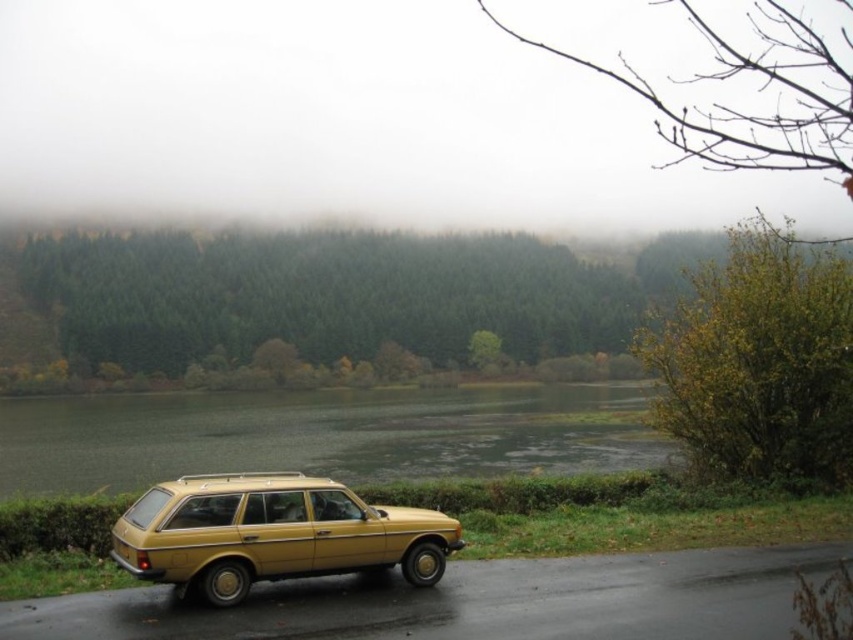
You are standing at the position of the vintage yellow station wagon parked on the wet dark road. Looking towards the lake, where would you see the green matte water at center located in terms of coordinates?

The green matte water at center is located at coordinates point (322, 435).

You are planning to take a photo of the gold matte station wagon at lower left and the green matte water at center. Which object should you focus on first if you want to capture both in a single frame without moving the camera, considering their sizes?

The gold matte station wagon at lower left is smaller than the green matte water at center, so you should focus on the gold matte station wagon at lower left first to ensure it is properly framed before adjusting for the larger green matte water at center.